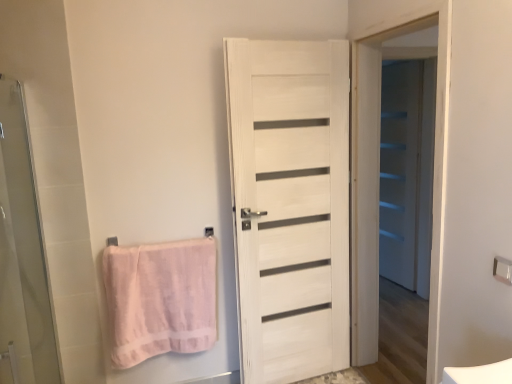
Question: Is white wood door at center at the left side of metallic silver towel bar at upper right, acting as the first towel bar starting from the right?

Choices:
 (A) no
 (B) yes

Answer: (B)

Question: Is white wood door at center behind metallic silver towel bar at upper right, which is counted as the second towel bar, starting from the back?

Choices:
 (A) yes
 (B) no

Answer: (A)

Question: Is white wood door at center completely or partially outside of metallic silver towel bar at upper right, positioned as the first towel bar in front-to-back order?

Choices:
 (A) yes
 (B) no

Answer: (A)

Question: Could you tell me if white wood door at center is turned towards metallic silver towel bar at upper right, positioned as the first towel bar in front-to-back order?

Choices:
 (A) yes
 (B) no

Answer: (A)

Question: Can you confirm if white wood door at center is bigger than metallic silver towel bar at upper right, positioned as the first towel bar in front-to-back order?

Choices:
 (A) yes
 (B) no

Answer: (A)

Question: Is metallic silver towel bar at upper right, positioned as the first towel bar in front-to-back order, bigger or smaller than white wood door at center?

Choices:
 (A) small
 (B) big

Answer: (A)

Question: Relative to white wood door at center, is metallic silver towel bar at upper right, which is the second towel bar in left-to-right order, in front or behind?

Choices:
 (A) behind
 (B) front

Answer: (B)

Question: Is metallic silver towel bar at upper right, acting as the first towel bar starting from the right, wider or thinner than white wood door at center?

Choices:
 (A) wide
 (B) thin

Answer: (B)

Question: Based on their positions, is metallic silver towel bar at upper right, positioned as the first towel bar in front-to-back order, located to the left or right of white wood door at center?

Choices:
 (A) right
 (B) left

Answer: (A)

Question: From the image's perspective, is transparent glass screen door at left, arranged as the 3th screen door when viewed from the back, positioned above or below white wood door at center?

Choices:
 (A) below
 (B) above

Answer: (A)

Question: In terms of width, does transparent glass screen door at left, arranged as the 3th screen door when viewed from the back, look wider or thinner when compared to white wood door at center?

Choices:
 (A) wide
 (B) thin

Answer: (A)

Question: From a real-world perspective, is transparent glass screen door at left, the 3th screen door in the right-to-left sequence, physically located above or below white wood door at center?

Choices:
 (A) below
 (B) above

Answer: (B)

Question: Would you say transparent glass screen door at left, the 1th screen door when ordered from front to back, is inside or outside white wood door at center?

Choices:
 (A) outside
 (B) inside

Answer: (A)

Question: In terms of size, does white wooden door at center, the second screen door when ordered from left to right, appear bigger or smaller than metallic silver towel bar at upper right, which is the second towel bar in left-to-right order?

Choices:
 (A) big
 (B) small

Answer: (A)

Question: Is white wooden door at center, placed as the 2th screen door when sorted from back to front, wider or thinner than metallic silver towel bar at upper right, which is counted as the second towel bar, starting from the back?

Choices:
 (A) wide
 (B) thin

Answer: (A)